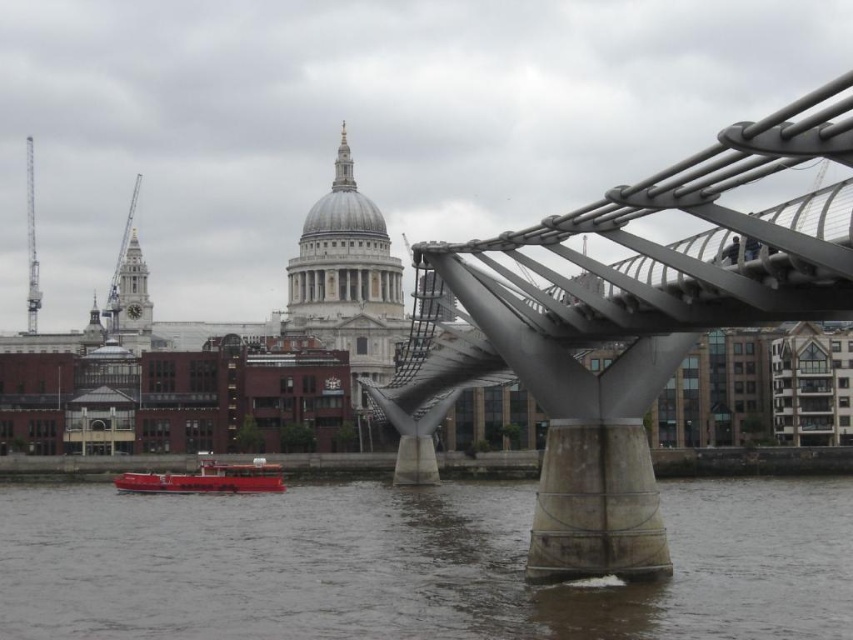
You are a photographer planning to capture the polished steel bridge at center and the metallic red boat at lower left in a single frame. Given that the bridge is wider than the boat, how might you position your camera to ensure both are clearly visible?

Since the polished steel bridge at center is wider than the metallic red boat at lower left, positioning the camera to focus on the bridge while leaving enough space in the frame for the boat at the lower left will ensure both are clearly visible.

You are a tourist standing on the Millennium Bridge and want to take a photo of the brown concrete river at lower center and the metallic red boat at lower left. Which object should you focus on first to ensure both are in the frame?

You should focus on the brown concrete river at lower center first because it is in front of the metallic red boat at lower left, so positioning the camera to include the foreground object will naturally include the background one as well.

You are a tourist standing on the Millennium Bridge and looking at the brown concrete river at lower center and the metallic red boat at lower left. Which object is positioned lower in the scene?

The brown concrete river at lower center is positioned below the metallic red boat at lower left, so it is lower in the scene.